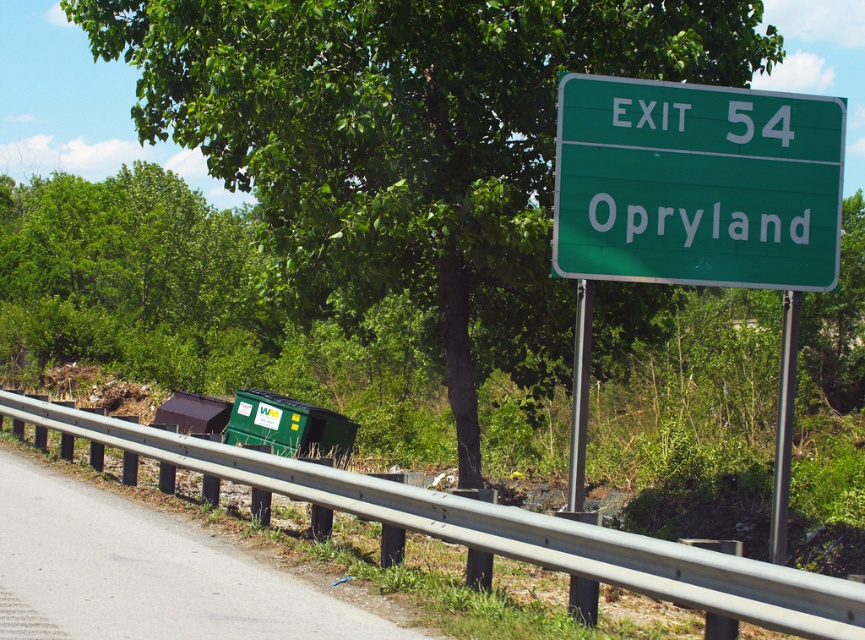
Is green leafy tree at upper center to the left of green plastic trash can at lower center from the viewer's perspective?

Incorrect, green leafy tree at upper center is not on the left side of green plastic trash can at lower center.

Does green leafy tree at upper center appear over green plastic trash can at lower center?

Indeed, green leafy tree at upper center is positioned over green plastic trash can at lower center.

Which is in front, point (554, 124) or point (94, 532)?

Point (94, 532) is more forward.

You are a GUI agent. You are given a task and a screenshot of the screen. Output one action in this format:
    pyautogui.click(x=<x>, y=<y>)
    Task: Click on the green leafy tree at upper center
    
    Given the screenshot: What is the action you would take?
    tap(409, 144)

Is point (694, 172) closer to camera compared to point (356, 636)?

No, (694, 172) is further to viewer.

Is green matte sign at upper center taller than green plastic trash can at lower center?

Yes.

Between point (785, 228) and point (33, 481), which one is positioned in front?

Point (785, 228)

You are a GUI agent. You are given a task and a screenshot of the screen. Output one action in this format:
    pyautogui.click(x=<x>, y=<y>)
    Task: Click on the green matte sign at upper center
    This screenshot has width=865, height=640.
    Given the screenshot: What is the action you would take?
    pyautogui.click(x=696, y=184)

Which is more to the right, green leafy tree at upper center or green matte sign at upper center?

Positioned to the right is green matte sign at upper center.

The height and width of the screenshot is (640, 865). Describe the element at coordinates (409, 144) in the screenshot. I see `green leafy tree at upper center` at that location.

This screenshot has height=640, width=865. Find the location of `green leafy tree at upper center`. green leafy tree at upper center is located at coordinates (409, 144).